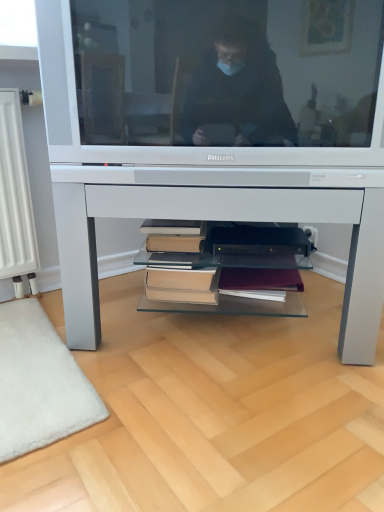
Locate an element on the screen. The width and height of the screenshot is (384, 512). hardcover books at center is located at coordinates (178, 263).

Can you confirm if white glossy desk at center is positioned to the right of hardcover books at center?

Yes.

Can you confirm if white glossy desk at center is shorter than hardcover books at center?

No, white glossy desk at center is not shorter than hardcover books at center.

Which is closer to the camera, (x=375, y=190) or (x=163, y=245)?

Clearly, point (x=375, y=190) is closer to the camera than point (x=163, y=245).

Identify the location of book located below the matte silver television at center (from the image's perspective). (178, 263).

Is point (357, 161) closer or farther from the camera than point (198, 303)?

Point (357, 161) appears to be closer to the viewer than point (198, 303).

Is matte silver television at center to the left of hardcover books at center from the viewer's perspective?

No.

Are hardcover books at center and white glossy desk at center located far from each other?

No.

Does hardcover books at center have a lesser width compared to white glossy desk at center?

Yes.

Is hardcover books at center to the left or to the right of white glossy desk at center in the image?

hardcover books at center is to the left of white glossy desk at center.

Considering the relative sizes of hardcover books at center and white glossy desk at center in the image provided, is hardcover books at center bigger than white glossy desk at center?

Incorrect, hardcover books at center is not larger than white glossy desk at center.

Does hardcover books at center have a lesser width compared to matte silver television at center?

Yes.

At what (x,y) coordinates should I click in order to perform the action: click on television located above the hardcover books at center (from a real-world perspective). Please return your answer as a coordinate pair (x, y). This screenshot has height=512, width=384. Looking at the image, I should click on (213, 82).

Does point (194, 294) come in front of point (303, 79)?

No, (194, 294) is behind (303, 79).

Between hardcover books at center and matte silver television at center, which one has more height?

With more height is matte silver television at center.

Which object is thinner, white glossy desk at center or matte silver television at center?

Thinner between the two is matte silver television at center.

Considering the positions of point (96, 177) and point (182, 161), is point (96, 177) closer or farther from the camera than point (182, 161)?

Clearly, point (96, 177) is more distant from the camera than point (182, 161).

From a real-world perspective, is white glossy desk at center under matte silver television at center?

Correct, in the physical world, white glossy desk at center is lower than matte silver television at center.

From the image's perspective, would you say white glossy desk at center is shown under matte silver television at center?

Yes, from the image's perspective, white glossy desk at center is beneath matte silver television at center.

Is the depth of matte silver television at center greater than that of white glossy desk at center?

No.

Is matte silver television at center facing towards white glossy desk at center?

No, matte silver television at center does not turn towards white glossy desk at center.

Is matte silver television at center inside or outside of white glossy desk at center?

matte silver television at center is located beyond the bounds of white glossy desk at center.

How far apart are matte silver television at center and white glossy desk at center?

A distance of 19.48 centimeters exists between matte silver television at center and white glossy desk at center.

The height and width of the screenshot is (512, 384). I want to click on book below the white glossy desk at center (from the image's perspective), so click(178, 263).

Where is `book located underneath the matte silver television at center (from a real-world perspective)`? Image resolution: width=384 pixels, height=512 pixels. book located underneath the matte silver television at center (from a real-world perspective) is located at coordinates (178, 263).

Estimate the real-world distances between objects in this image. Which object is further from white glossy desk at center, matte silver television at center or hardcover books at center?

hardcover books at center is positioned further to the anchor white glossy desk at center.

Based on their spatial positions, is hardcover books at center or white glossy desk at center further from matte silver television at center?

Based on the image, hardcover books at center appears to be further to matte silver television at center.

Which object lies further to the anchor point matte silver television at center, white glossy desk at center or hardcover books at center?

The object further to matte silver television at center is hardcover books at center.

Looking at the image, which one is located closer to hardcover books at center, matte silver television at center or white glossy desk at center?

The object closer to hardcover books at center is white glossy desk at center.

Looking at the image, which one is located further to hardcover books at center, white glossy desk at center or matte silver television at center?

matte silver television at center is positioned further to the anchor hardcover books at center.

From the image, which object appears to be nearer to white glossy desk at center, hardcover books at center or matte silver television at center?

The object closer to white glossy desk at center is matte silver television at center.

Where is `desk between matte silver television at center and hardcover books at center in the vertical direction`? The image size is (384, 512). desk between matte silver television at center and hardcover books at center in the vertical direction is located at coordinates (223, 219).